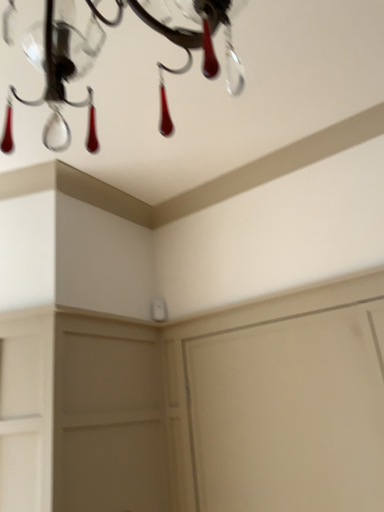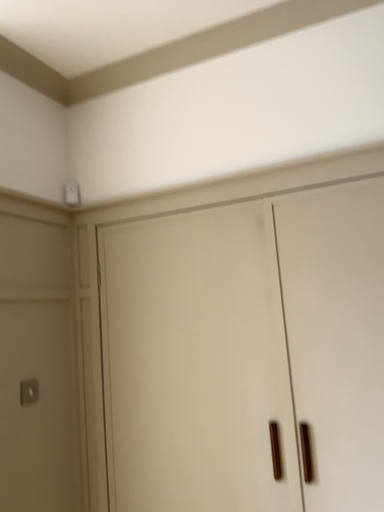
Question: Which way did the camera rotate in the video?

Choices:
 (A) rotated upward
 (B) rotated downward

Answer: (B)